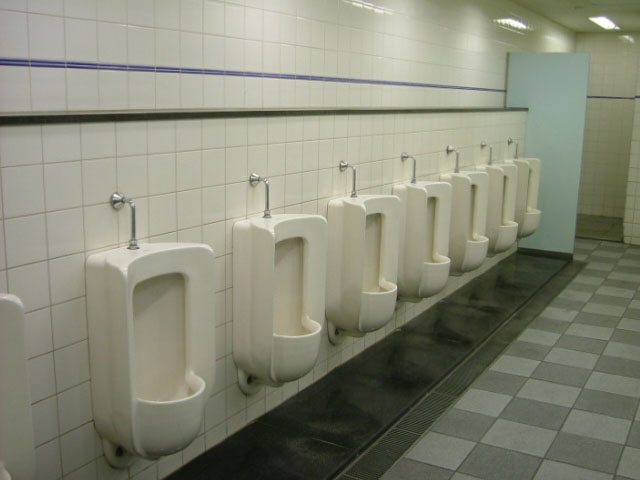
Locate an element on the screen. The image size is (640, 480). urinal is located at coordinates (13, 423), (136, 388), (292, 333), (365, 224), (429, 224), (467, 199), (504, 191), (523, 178).